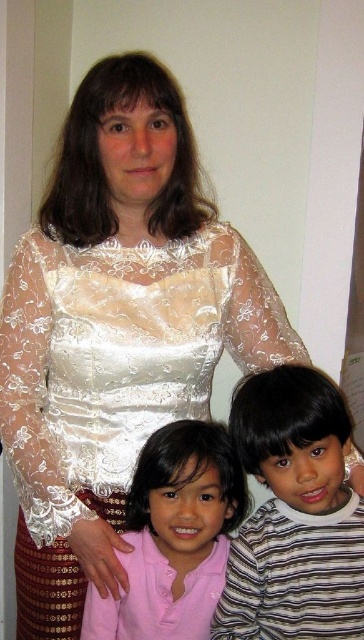
Question: Can you confirm if striped cotton shirt at lower center is positioned above pink satin shirt at lower left?

Choices:
 (A) no
 (B) yes

Answer: (B)

Question: Is striped cotton shirt at lower center to the right of pink satin shirt at lower left from the viewer's perspective?

Choices:
 (A) yes
 (B) no

Answer: (A)

Question: Which object is closer to the camera taking this photo?

Choices:
 (A) striped cotton shirt at lower center
 (B) pink satin shirt at lower left

Answer: (A)

Question: Which object is farther from the camera taking this photo?

Choices:
 (A) pink satin shirt at lower left
 (B) striped cotton shirt at lower center

Answer: (A)

Question: Is striped cotton shirt at lower center further to the viewer compared to pink satin shirt at lower left?

Choices:
 (A) no
 (B) yes

Answer: (A)

Question: Which point appears closest to the camera in this image?

Choices:
 (A) (192, 620)
 (B) (314, 554)

Answer: (B)